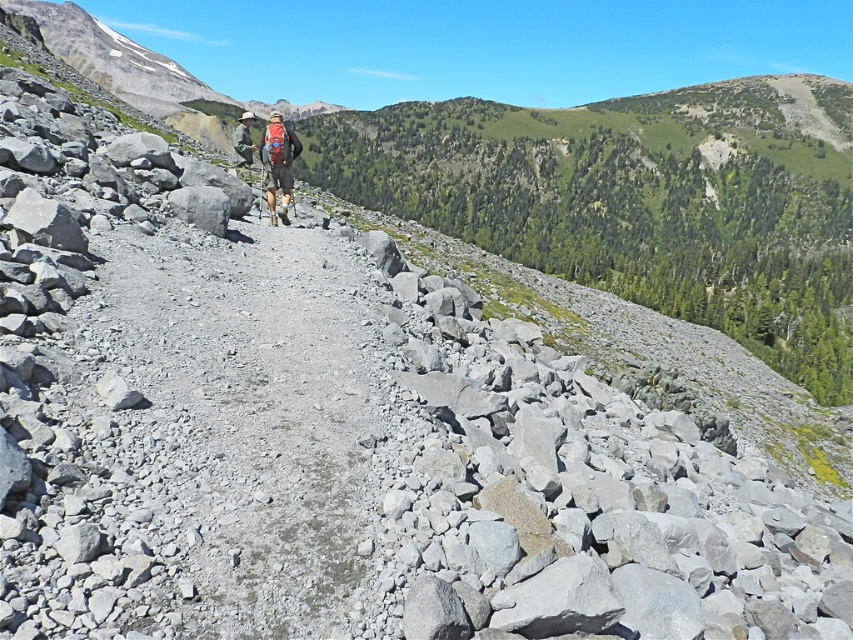
Does gray gravel trail at center appear over camouflage fabric backpack at center?

No.

The height and width of the screenshot is (640, 853). What are the coordinates of `gray gravel trail at center` in the screenshot? It's located at (247, 426).

Where is `gray gravel trail at center`? This screenshot has height=640, width=853. gray gravel trail at center is located at coordinates (247, 426).

At what (x,y) coordinates should I click in order to perform the action: click on gray gravel trail at center. Please return your answer as a coordinate pair (x, y). The image size is (853, 640). Looking at the image, I should click on click(247, 426).

Is matte black backpack at center to the right of camouflage fabric backpack at center from the viewer's perspective?

Indeed, matte black backpack at center is positioned on the right side of camouflage fabric backpack at center.

Identify the location of matte black backpack at center. The image size is (853, 640). (277, 163).

Where is `matte black backpack at center`? This screenshot has height=640, width=853. matte black backpack at center is located at coordinates (277, 163).

Can you confirm if gray gravel trail at center is smaller than matte black backpack at center?

Yes, gray gravel trail at center is smaller than matte black backpack at center.

Based on the photo, can you confirm if gray gravel trail at center is wider than matte black backpack at center?

No.

Is point (224, 371) positioned after point (270, 141)?

No.

Find the location of a particular element. This screenshot has width=853, height=640. gray gravel trail at center is located at coordinates (247, 426).